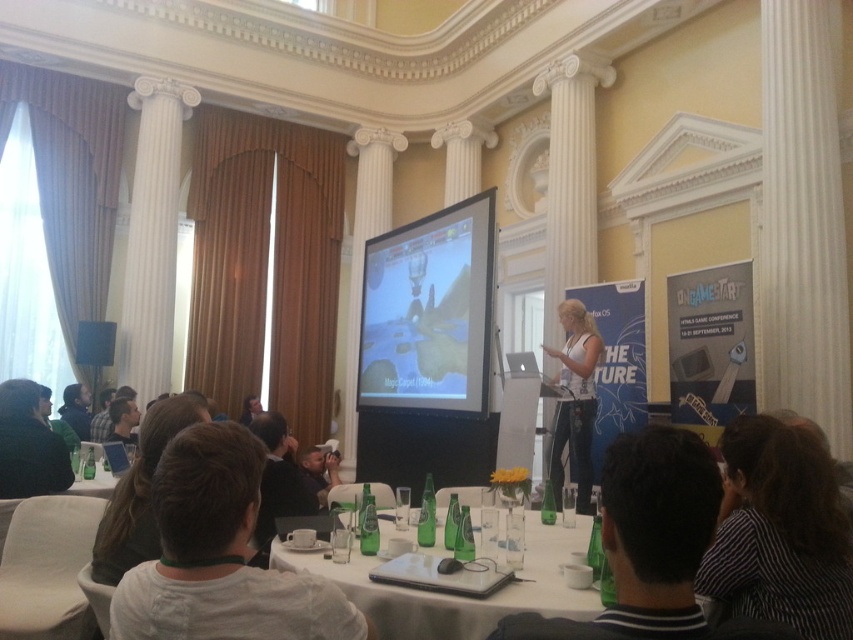
Question: Which object is positioned closest to the white glossy table at lower center?

Choices:
 (A) green glass bottles at lower left
 (B) matte black screen at center

Answer: (A)

Question: Can you confirm if black striped shirt at lower right is thinner than matte black screen at center?

Choices:
 (A) no
 (B) yes

Answer: (B)

Question: Estimate the real-world distances between objects in this image. Which object is farther from the green glass bottles at lower left?

Choices:
 (A) white matte tank top at center
 (B) black striped shirt at lower right
 (C) matte black screen at center

Answer: (B)

Question: Can you confirm if black striped shirt at lower right is positioned above white matte tank top at center?

Choices:
 (A) no
 (B) yes

Answer: (B)

Question: Can you confirm if white matte tank top at center is positioned below green glass bottles at lower left?

Choices:
 (A) yes
 (B) no

Answer: (B)

Question: Which object is farther from the camera taking this photo?

Choices:
 (A) white glossy table at lower center
 (B) black striped shirt at lower right
 (C) white matte tank top at center
 (D) green glass bottles at lower left

Answer: (C)